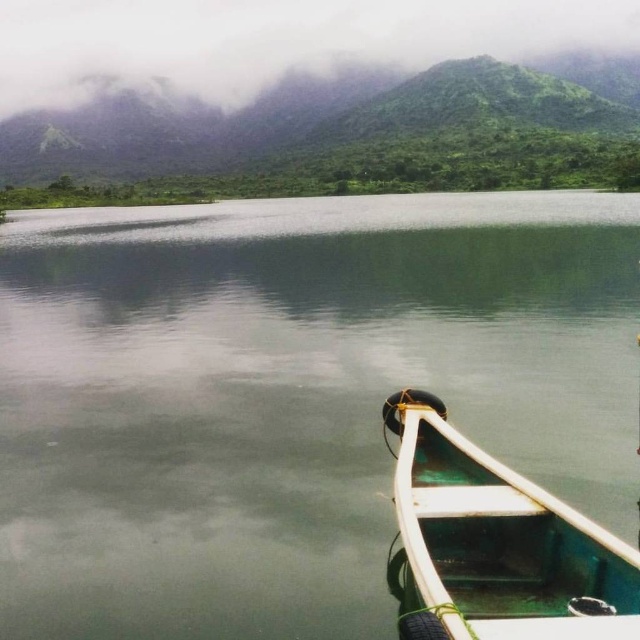
Question: Considering the real-world distances, which object is farthest from the green smooth water at center?

Choices:
 (A) green textured mountain at upper center
 (B) green matte boat at lower right

Answer: (A)

Question: Is green smooth water at center positioned in front of green textured mountain at upper center?

Choices:
 (A) no
 (B) yes

Answer: (B)

Question: Considering the relative positions of green smooth water at center and green matte mountain at upper center in the image provided, where is green smooth water at center located with respect to green matte mountain at upper center?

Choices:
 (A) left
 (B) right

Answer: (A)

Question: Does green smooth water at center appear on the left side of green matte boat at lower right?

Choices:
 (A) yes
 (B) no

Answer: (A)

Question: Among these points, which one is nearest to the camera?

Choices:
 (A) (234, 205)
 (B) (58, 90)
 (C) (433, 540)

Answer: (C)

Question: Which point appears farthest from the camera in this image?

Choices:
 (A) (452, 170)
 (B) (552, 602)
 (C) (26, 436)

Answer: (A)